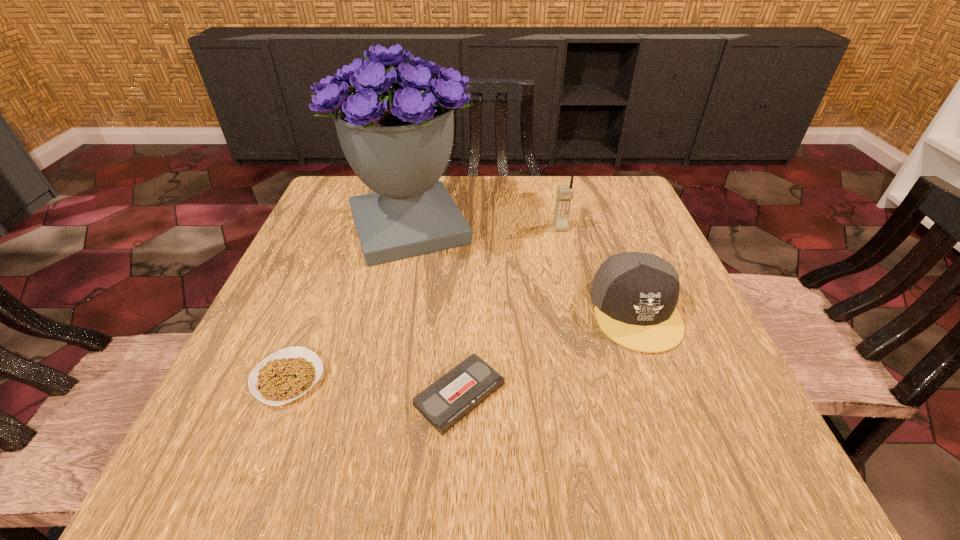
This screenshot has height=540, width=960. I want to click on vacant area at the left edge of the desktop, so click(x=250, y=357).

Locate an element on the screen. The image size is (960, 540). vacant area at the right edge of the desktop is located at coordinates (716, 349).

The height and width of the screenshot is (540, 960). I want to click on vacant region at the far left corner of the desktop, so click(354, 178).

Locate an element on the screen. vacant space at the near left corner of the desktop is located at coordinates (233, 449).

You are a GUI agent. You are given a task and a screenshot of the screen. Output one action in this format:
    pyautogui.click(x=<x>, y=<y>)
    Task: Click on the vacant area at the far right corner of the desktop
    
    Given the screenshot: What is the action you would take?
    pyautogui.click(x=582, y=199)

Locate an element on the screen. This screenshot has width=960, height=540. free region at the near right corner of the desktop is located at coordinates (693, 451).

This screenshot has width=960, height=540. I want to click on vacant area between the cap and the shortest object, so click(x=547, y=353).

Locate an element on the screen. This screenshot has height=540, width=960. free space between the rightmost object and the videotape is located at coordinates (547, 353).

Identify the location of free space between the second shortest object and the bouquet. The height and width of the screenshot is (540, 960). (348, 302).

Find the location of a particular element. empty space that is in between the bouquet and the shortest object is located at coordinates (434, 310).